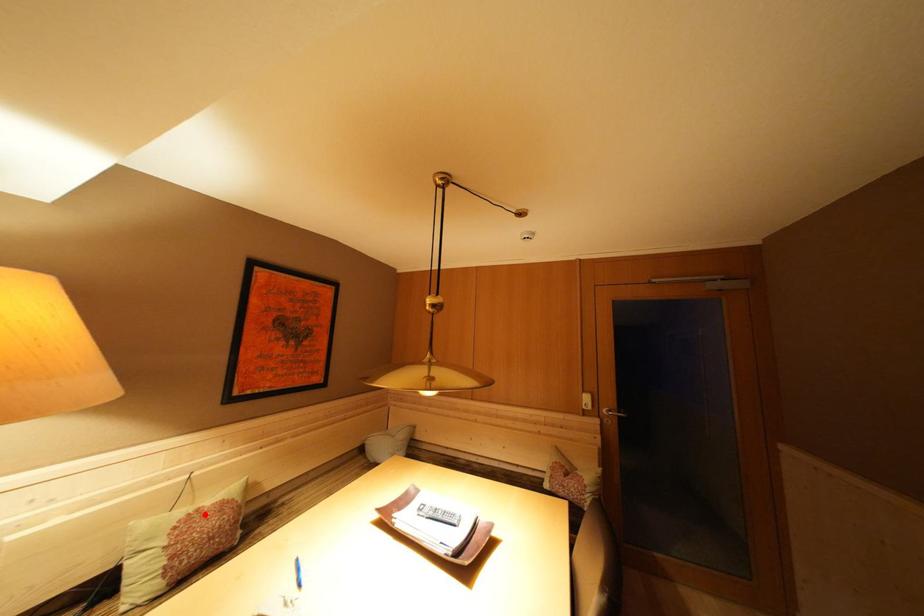
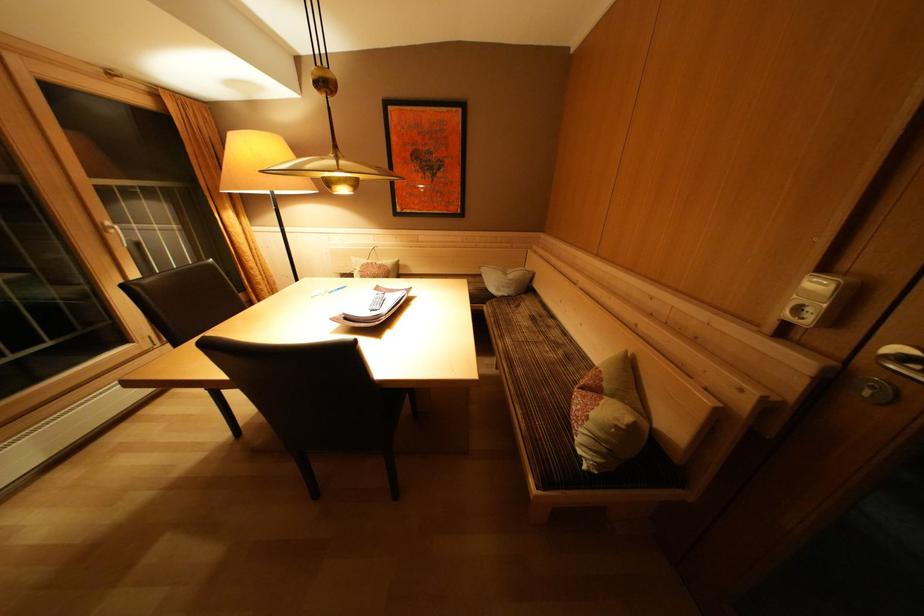
In the second image, find the point that corresponds to the highlighted location in the first image.

(379, 268)